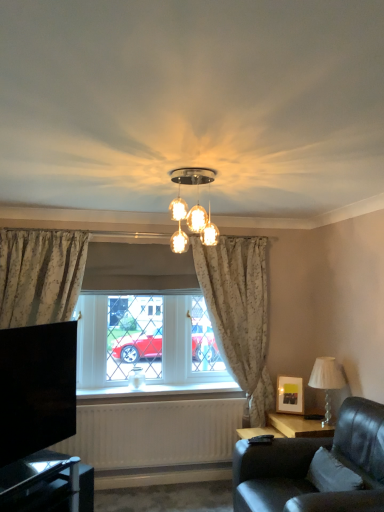
What do you see at coordinates (332, 474) in the screenshot? I see `white fabric pillow at lower right` at bounding box center [332, 474].

Image resolution: width=384 pixels, height=512 pixels. Describe the element at coordinates (310, 463) in the screenshot. I see `leather couch at lower right` at that location.

Measure the distance between white textured curtains at left and camera.

The depth of white textured curtains at left is 3.48 meters.

Measure the distance between white textured radiator at lower center and camera.

They are 10.91 feet apart.

Locate an element on the screen. The width and height of the screenshot is (384, 512). white floral fabric curtain at center is located at coordinates (239, 313).

You are a GUI agent. You are given a task and a screenshot of the screen. Output one action in this format:
    pyautogui.click(x=<x>, y=<y>)
    Task: Click on the translucent glass chandelier at center, the 2th lamp from the back
    This screenshot has height=512, width=384.
    Given the screenshot: What is the action you would take?
    pyautogui.click(x=191, y=209)

What do you see at coordinates (191, 209) in the screenshot?
I see `translucent glass chandelier at center, the 2th lamp ordered from the bottom` at bounding box center [191, 209].

You are a GUI agent. You are given a task and a screenshot of the screen. Output one action in this format:
    pyautogui.click(x=<x>, y=<y>)
    Task: Click on the black glass table at lower left
    Image resolution: width=384 pixels, height=512 pixels.
    Given the screenshot: What is the action you would take?
    pos(47,484)

Describe the element at coordinates (39, 419) in the screenshot. This screenshot has width=384, height=512. I see `black glossy tv at lower left` at that location.

What are the coordinates of `white fabric pillow at lower right` in the screenshot? It's located at (332, 474).

Can you see white fabric pillow at lower right touching leather couch at lower right?

They are not placed beside each other.

Is white fabric pillow at lower right shorter than leather couch at lower right?

Correct, white fabric pillow at lower right is not as tall as leather couch at lower right.

Which of these two, white fabric pillow at lower right or leather couch at lower right, is smaller?

white fabric pillow at lower right.

Which of these two, white fabric pillow at lower right or leather couch at lower right, is thinner?

white fabric pillow at lower right is thinner.

Is there a large distance between white textured radiator at lower center and translucent glass chandelier at center, the 1th lamp from the front?

white textured radiator at lower center is far away from translucent glass chandelier at center, the 1th lamp from the front.

Between white textured radiator at lower center and translucent glass chandelier at center, the 2th lamp ordered from the bottom, which one has smaller width?

With smaller width is white textured radiator at lower center.

Is translucent glass chandelier at center, acting as the 1th lamp starting from the top, at the back of white textured radiator at lower center?

That's not correct — white textured radiator at lower center is not looking away from translucent glass chandelier at center, acting as the 1th lamp starting from the top.

Is white textured radiator at lower center not inside translucent glass chandelier at center, the 2th lamp from the back?

Yes.

Is white textured lampshade at right, arranged as the first lamp when ordered from the bottom, taller than white fabric pillow at lower right?

Yes.

This screenshot has height=512, width=384. What are the coordinates of `lamp behind the white fabric pillow at lower right` in the screenshot? It's located at (326, 382).

Does white textured lampshade at right, arranged as the first lamp when ordered from the bottom, lie behind white fabric pillow at lower right?

Yes, white textured lampshade at right, arranged as the first lamp when ordered from the bottom, is further from the camera.

Can you confirm if white textured lampshade at right, positioned as the 1th lamp in right-to-left order, is bigger than white fabric pillow at lower right?

Yes.

In the image, is white textured curtains at left positioned in front of or behind white floral fabric curtain at center?

Visually, white textured curtains at left is located in front of white floral fabric curtain at center.

Is white textured curtains at left directly adjacent to white floral fabric curtain at center?

No, white textured curtains at left is not in contact with white floral fabric curtain at center.

Considering the relative sizes of white textured curtains at left and white floral fabric curtain at center in the image provided, is white textured curtains at left taller than white floral fabric curtain at center?

No.

Could you tell me if white textured curtains at left is turned towards white floral fabric curtain at center?

Yes, white textured curtains at left is aimed at white floral fabric curtain at center.

Consider the image. Is white fabric pillow at lower right in front of or behind white floral fabric curtain at center in the image?

white fabric pillow at lower right is in front of white floral fabric curtain at center.

Is white fabric pillow at lower right positioned with its back to white floral fabric curtain at center?

No, white floral fabric curtain at center is not at the back of white fabric pillow at lower right.

Who is taller, white fabric pillow at lower right or white floral fabric curtain at center?

white floral fabric curtain at center is taller.

Considering the relative sizes of white fabric pillow at lower right and white floral fabric curtain at center in the image provided, is white fabric pillow at lower right wider than white floral fabric curtain at center?

No, white fabric pillow at lower right is not wider than white floral fabric curtain at center.

Considering the relative sizes of white textured curtains at left and white textured radiator at lower center in the image provided, is white textured curtains at left bigger than white textured radiator at lower center?

Correct, white textured curtains at left is larger in size than white textured radiator at lower center.

Consider the image. Between white textured curtains at left and white textured radiator at lower center, which one has less height?

With less height is white textured radiator at lower center.

You are a GUI agent. You are given a task and a screenshot of the screen. Output one action in this format:
    pyautogui.click(x=<x>, y=<y>)
    Task: Click on the radiator in front of the white textured curtains at left
    
    Given the screenshot: What is the action you would take?
    pyautogui.click(x=155, y=433)

Does point (157, 389) come closer to viewer compared to point (242, 406)?

No, it is not.

Which is nearer, (324, 389) or (314, 490)?

The point (314, 490) is closer.

Is white textured lampshade at right, the second lamp viewed from the front, next to leather couch at lower right?

No, white textured lampshade at right, the second lamp viewed from the front, is not in contact with leather couch at lower right.

Is the depth of white textured lampshade at right, arranged as the first lamp when ordered from the bottom, greater than that of leather couch at lower right?

Yes, the depth of white textured lampshade at right, arranged as the first lamp when ordered from the bottom, is greater than that of leather couch at lower right.

Considering the sizes of white textured lampshade at right, arranged as the first lamp when ordered from the bottom, and leather couch at lower right in the image, is white textured lampshade at right, arranged as the first lamp when ordered from the bottom, taller or shorter than leather couch at lower right?

In the image, white textured lampshade at right, arranged as the first lamp when ordered from the bottom, appears to be shorter than leather couch at lower right.

Find the location of a particular element. This screenshot has width=384, height=512. studio couch below the white fabric pillow at lower right (from the image's perspective) is located at coordinates (310, 463).

Find the location of a particular element. Image resolution: width=384 pixels, height=512 pixels. the 1st lamp to the right of the white textured radiator at lower center, starting your count from the anchor is located at coordinates (191, 209).

Estimate the real-world distances between objects in this image. Which object is closer to translucent glass chandelier at center, the 1th lamp from the front, white textured lampshade at right, the second lamp when ordered from top to bottom, or black glossy tv at lower left?

black glossy tv at lower left is positioned closer to the anchor translucent glass chandelier at center, the 1th lamp from the front.

From the image, which object appears to be farther from white fabric pillow at lower right, black glossy tv at lower left or white textured lampshade at right, positioned as the 1th lamp in right-to-left order?

black glossy tv at lower left is further to white fabric pillow at lower right.

Looking at the image, which one is located closer to white floral fabric curtain at center, white textured radiator at lower center or white textured lampshade at right, which is the 2th lamp in left-to-right order?

white textured lampshade at right, which is the 2th lamp in left-to-right order, is closer to white floral fabric curtain at center.

When comparing their distances from black glossy tv at lower left, does white textured radiator at lower center or white textured lampshade at right, positioned as the 1th lamp in right-to-left order, seem closer?

white textured radiator at lower center lies closer to black glossy tv at lower left than the other object.

Based on their spatial positions, is white floral fabric curtain at center or leather couch at lower right closer to white textured lampshade at right, positioned as the 1th lamp in right-to-left order?

leather couch at lower right lies closer to white textured lampshade at right, positioned as the 1th lamp in right-to-left order, than the other object.

When comparing their distances from white textured curtains at left, does translucent glass chandelier at center, acting as the 1th lamp starting from the top, or black glass table at lower left seem closer?

black glass table at lower left is positioned closer to the anchor white textured curtains at left.

Based on their spatial positions, is translucent glass chandelier at center, acting as the 1th lamp starting from the top, or white fabric pillow at lower right closer to leather couch at lower right?

white fabric pillow at lower right lies closer to leather couch at lower right than the other object.

Which object lies nearer to the anchor point translucent glass chandelier at center, the 2th lamp ordered from the bottom, white fabric pillow at lower right or white textured lampshade at right, which is the 2th lamp in left-to-right order?

white fabric pillow at lower right is positioned closer to the anchor translucent glass chandelier at center, the 2th lamp ordered from the bottom.

This screenshot has height=512, width=384. Find the location of `curtain between white textured curtains at left and white textured radiator at lower center in the vertical direction`. curtain between white textured curtains at left and white textured radiator at lower center in the vertical direction is located at coordinates (239, 313).

This screenshot has width=384, height=512. In order to click on radiator between black glossy tv at lower left and white textured curtains at left from front to back in this screenshot , I will do `click(155, 433)`.

The image size is (384, 512). Find the location of `entertainment center between black glass table at lower left and white textured curtains at left from front to back`. entertainment center between black glass table at lower left and white textured curtains at left from front to back is located at coordinates (39, 419).

The width and height of the screenshot is (384, 512). I want to click on pillow between white textured radiator at lower center and white textured lampshade at right, which is the first lamp in back-to-front order, from left to right, so click(x=332, y=474).